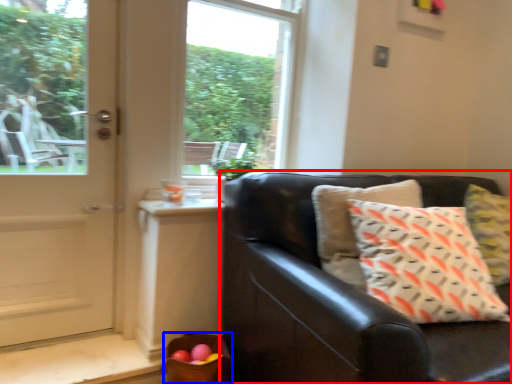
Question: Which object is closer to the camera taking this photo, studio couch (highlighted by a red box) or basket (highlighted by a blue box)?

Choices:
 (A) studio couch
 (B) basket

Answer: (A)